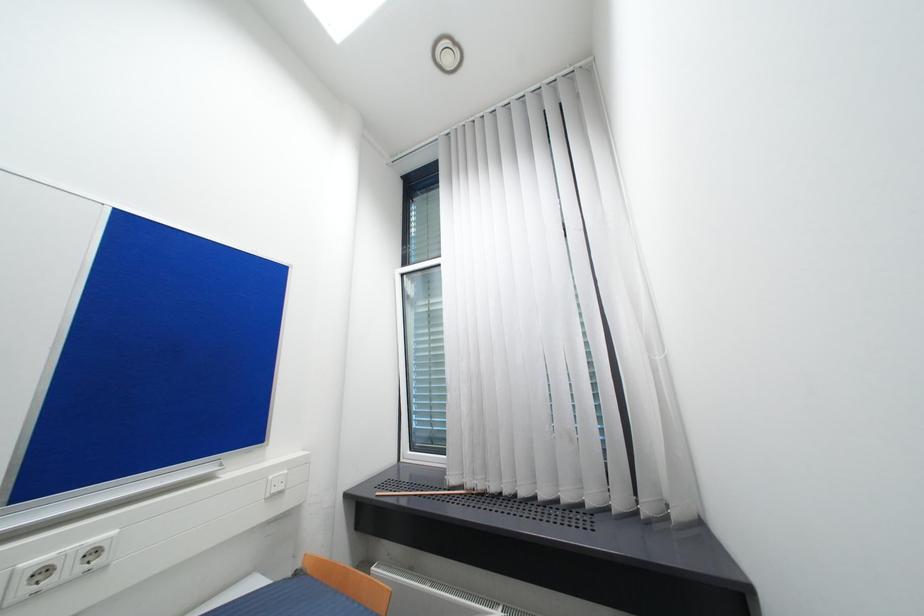
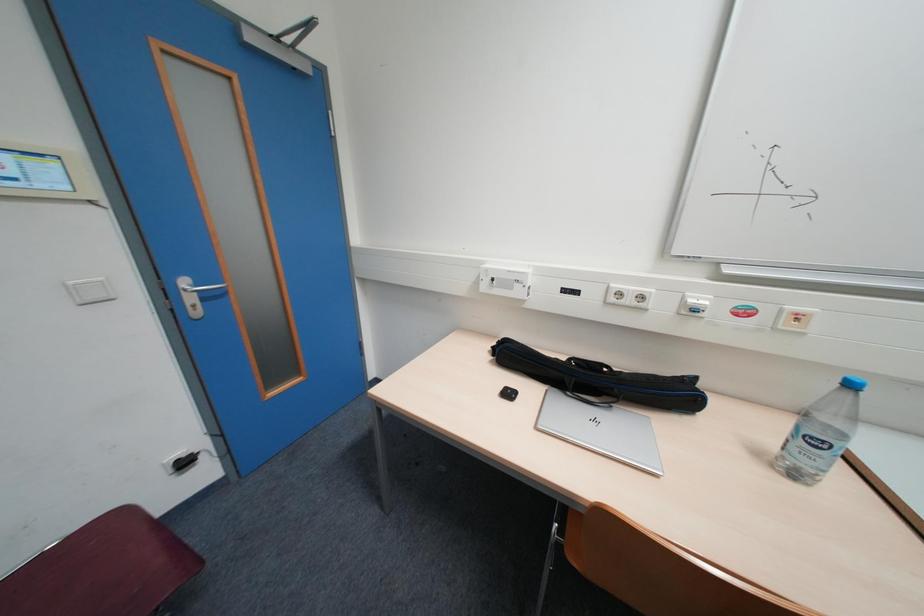
Consider the image. How did the camera likely rotate?

The camera rotated toward left-down.